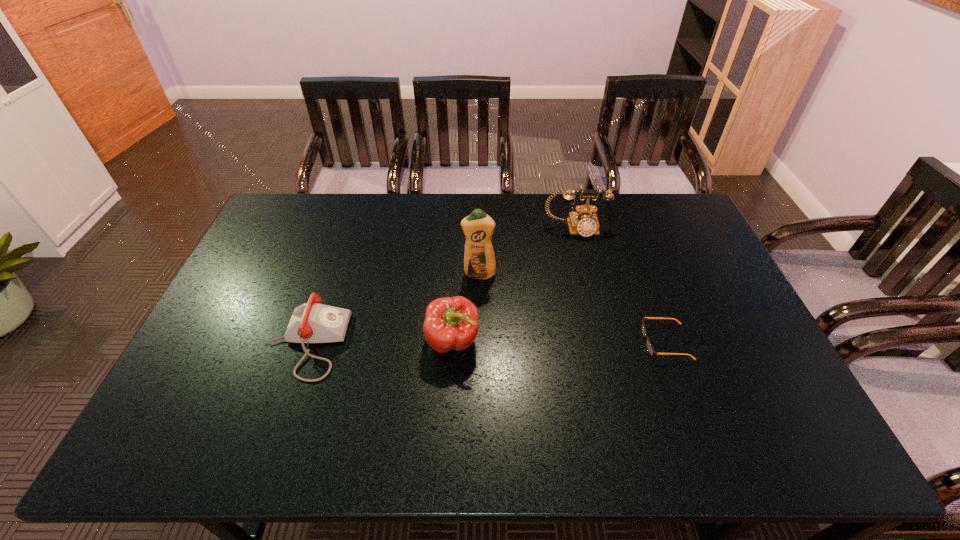
Image resolution: width=960 pixels, height=540 pixels. Identify the location of object that is the closest to the shortest object. (583, 221).

Identify which object is the fourth closest to the taller telephone. Please provide its 2D coordinates. Your answer should be formatted as a tuple, i.e. [(x, y)], where the tuple contains the x and y coordinates of a point satisfying the conditions above.

[(313, 322)]

Where is `free space that satisfies the following two spatial constraints: 1. on the dial number of the right telephone; 2. on the dial of the leftmost object`? Image resolution: width=960 pixels, height=540 pixels. free space that satisfies the following two spatial constraints: 1. on the dial number of the right telephone; 2. on the dial of the leftmost object is located at coordinates (603, 343).

Find the location of a particular element. This screenshot has height=540, width=960. blank space that satisfies the following two spatial constraints: 1. on the dial number of the farther telephone; 2. on the dial of the shorter telephone is located at coordinates (603, 343).